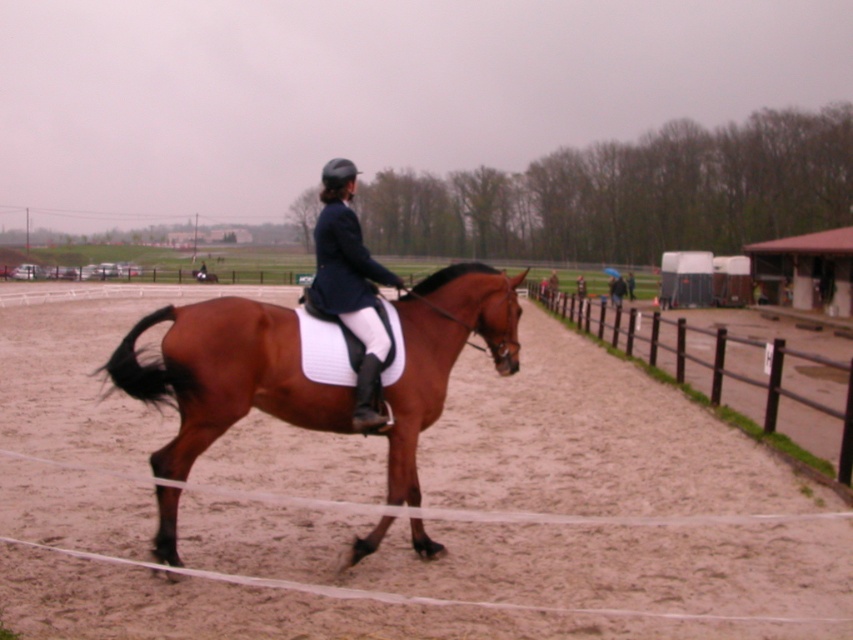
Looking at this image, you are a photographer standing at the edge of the arena. You want to capture a photo where the brown sand at center is visible above the brown glossy horse at center. Is this possible given their current positions?

Yes, since the brown sand at center is located above the brown glossy horse at center, the photographer can position themselves to capture the sand appearing above the horse in the photo.

You are a photographer standing at the edge of the arena. You want to take a picture of the brown glossy horse at center and the matte black riding jacket at center. Based on their positions, which object is located to the right of the other?

The brown glossy horse at center is positioned on the right side of matte black riding jacket at center, so the horse is to the right of the jacket.